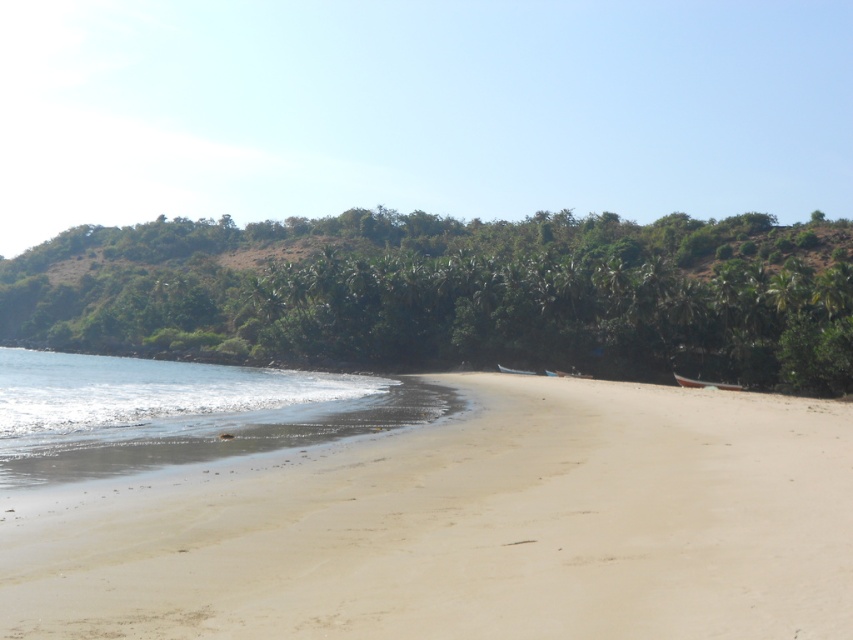
You are standing on the beach and see the light beige sand at lower left and the clear water at lower left. Which one is closer to your feet?

The light beige sand at lower left is closer to your feet because it is above the clear water at lower left, meaning the sand is on top of the water in this area.

You are standing on the beach and want to place a small bucket on the light beige sand at lower left without it getting wet. The clear water at lower left is nearby. Based on the scene, will the bucket stay dry?

The light beige sand at lower left is closer to the viewer than the clear water at lower left, so placing the bucket there would keep it away from the water, keeping it dry.